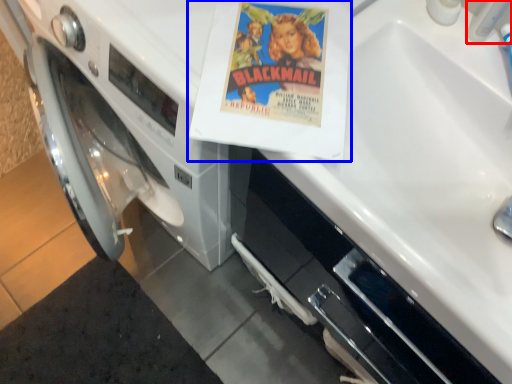
Question: Which of the following is the closest to the observer, faucet (highlighted by a red box) or paperback book (highlighted by a blue box)?

Choices:
 (A) faucet
 (B) paperback book

Answer: (A)